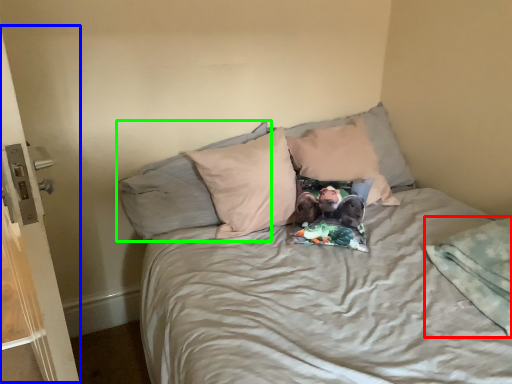
Question: Estimate the real-world distances between objects in this image. Which object is closer to blanket (highlighted by a red box), screen door (highlighted by a blue box) or pillow (highlighted by a green box)?

Choices:
 (A) screen door
 (B) pillow

Answer: (B)